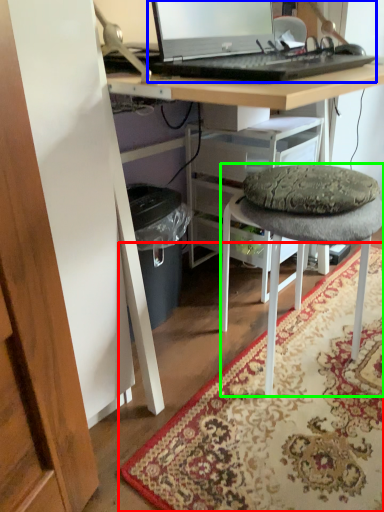
Question: Which object is the closest to the mat (highlighted by a red box)? Choose among these: computer (highlighted by a blue box) or stool (highlighted by a green box).

Choices:
 (A) computer
 (B) stool

Answer: (B)